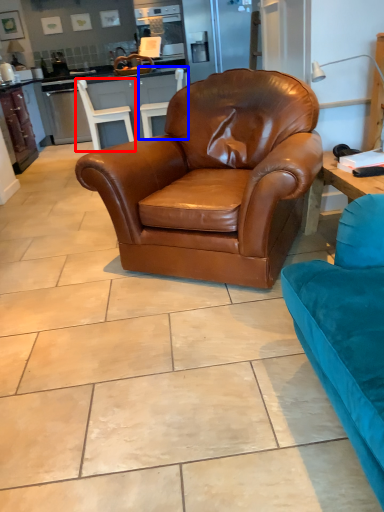
Question: Among these objects, which one is farthest to the camera, chair (highlighted by a red box) or chair (highlighted by a blue box)?

Choices:
 (A) chair
 (B) chair

Answer: (B)